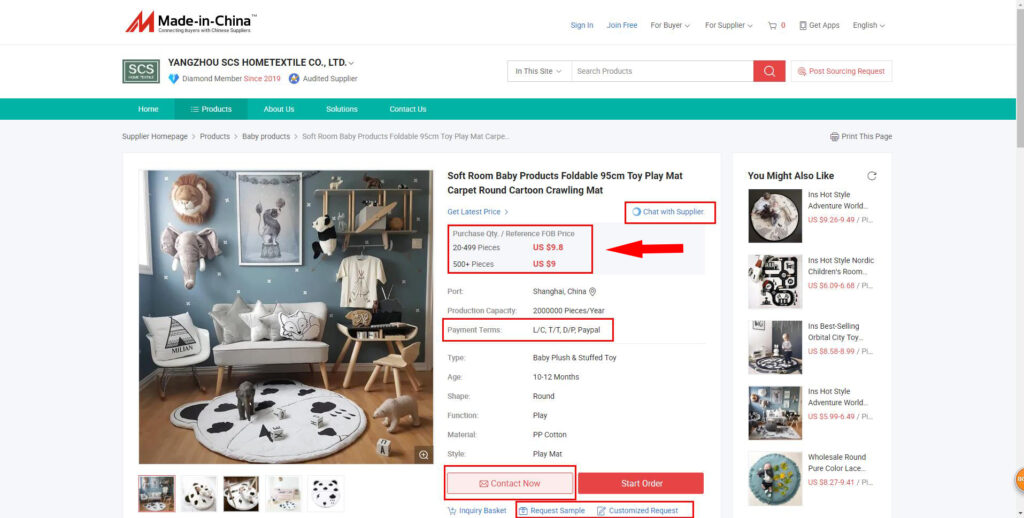
What are the coordinates of `child table and chair` in the screenshot? It's located at (384, 334), (393, 362).